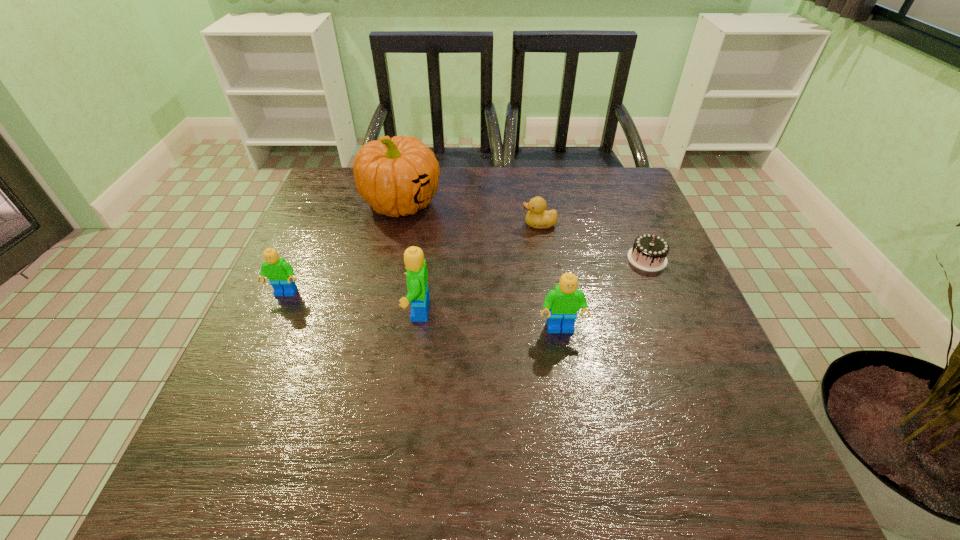
At what (x,y) coordinates should I click in order to perform the action: click on object identified as the third closest to the duckling. Please return your answer as a coordinate pair (x, y). The height and width of the screenshot is (540, 960). Looking at the image, I should click on (562, 304).

The height and width of the screenshot is (540, 960). In order to click on object that is the closest to the leftmost object in this screenshot , I will do `click(396, 176)`.

I want to click on Lego object that ranks as the closest to the rightmost object, so click(x=562, y=304).

Find the location of a particular element. Lego identified as the closest to the second Lego from left to right is located at coordinates (562, 304).

Identify the location of free location that satisfies the following two spatial constraints: 1. on the front side of the rightmost object; 2. on the face of the second Lego from right to left. (668, 311).

Locate an element on the screen. vacant region that satisfies the following two spatial constraints: 1. on the surface of the rightmost object; 2. on the right side of the pumpkin is located at coordinates (389, 259).